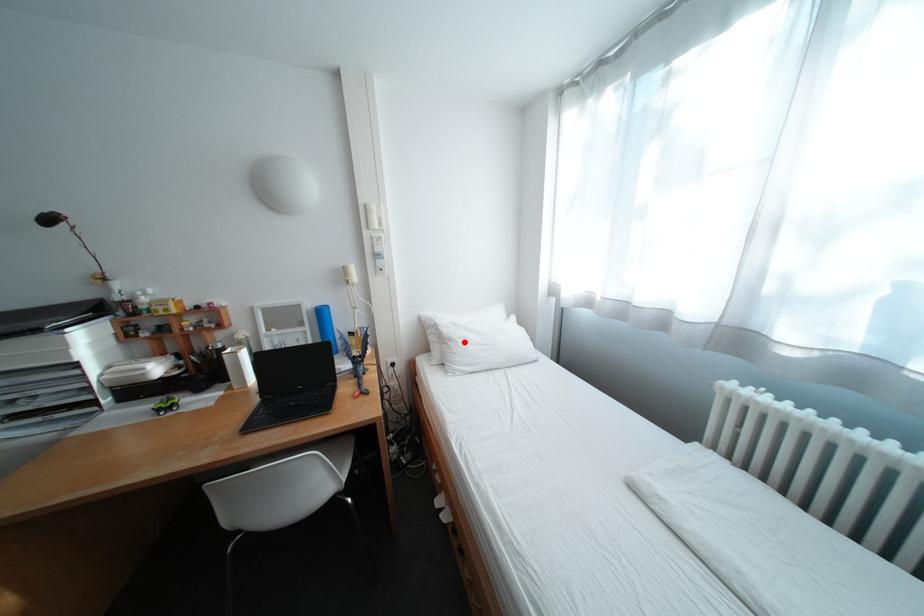
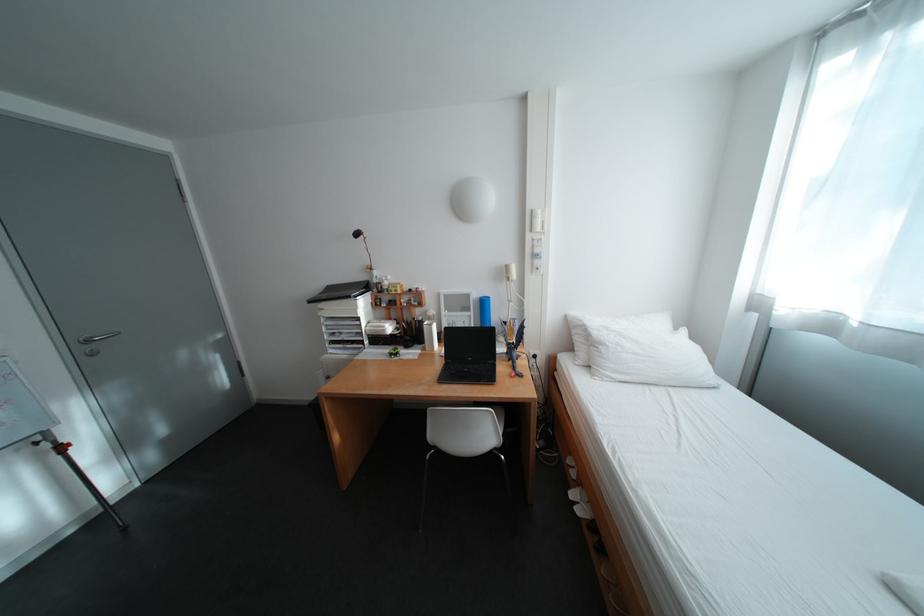
In the second image, find the point that corresponds to the highlighted location in the first image.

(614, 346)